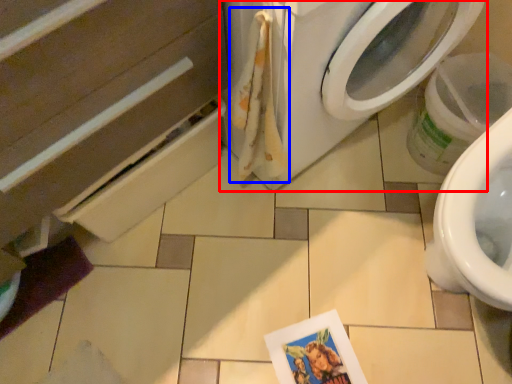
Question: Which object is further to the camera taking this photo, washing machine (highlighted by a red box) or laundry (highlighted by a blue box)?

Choices:
 (A) washing machine
 (B) laundry

Answer: (B)